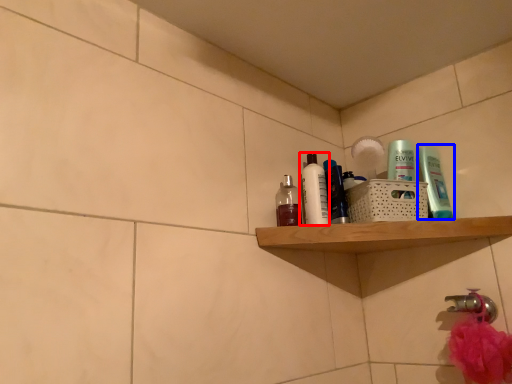
Question: Among these objects, which one is nearest to the camera, toiletry (highlighted by a red box) or toiletry (highlighted by a blue box)?

Choices:
 (A) toiletry
 (B) toiletry

Answer: (B)